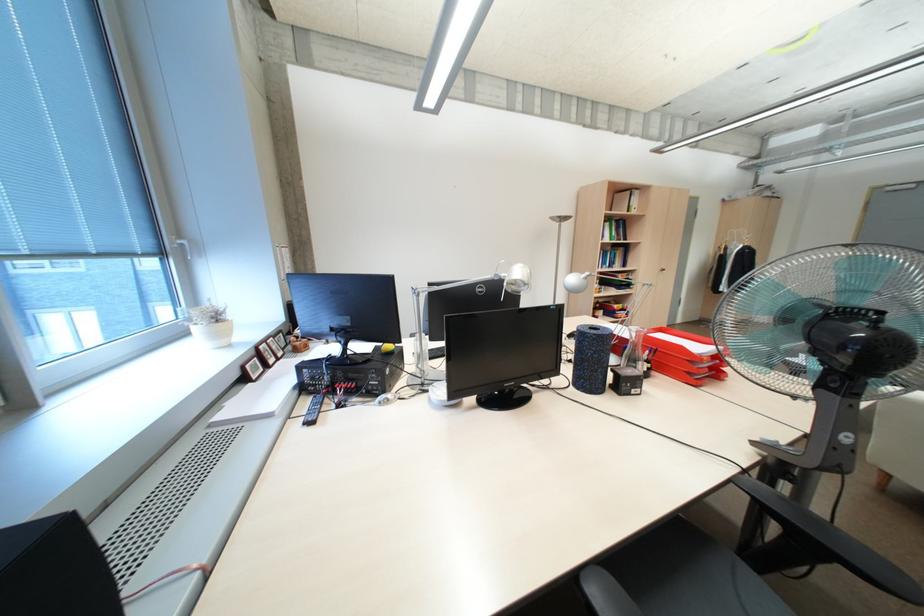
What do you see at coordinates (684, 355) in the screenshot?
I see `a red paper tray` at bounding box center [684, 355].